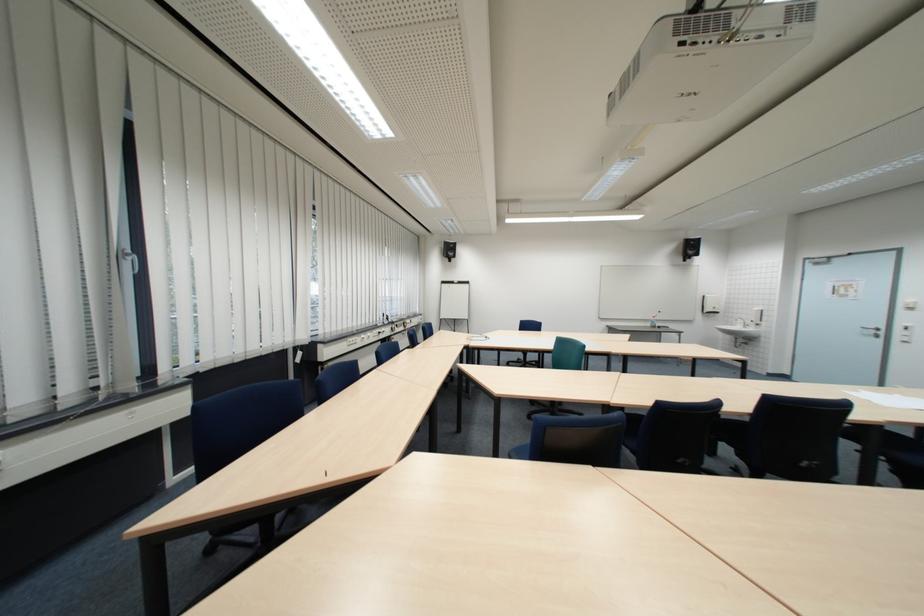
What do you see at coordinates (129, 259) in the screenshot?
I see `the white window handle` at bounding box center [129, 259].